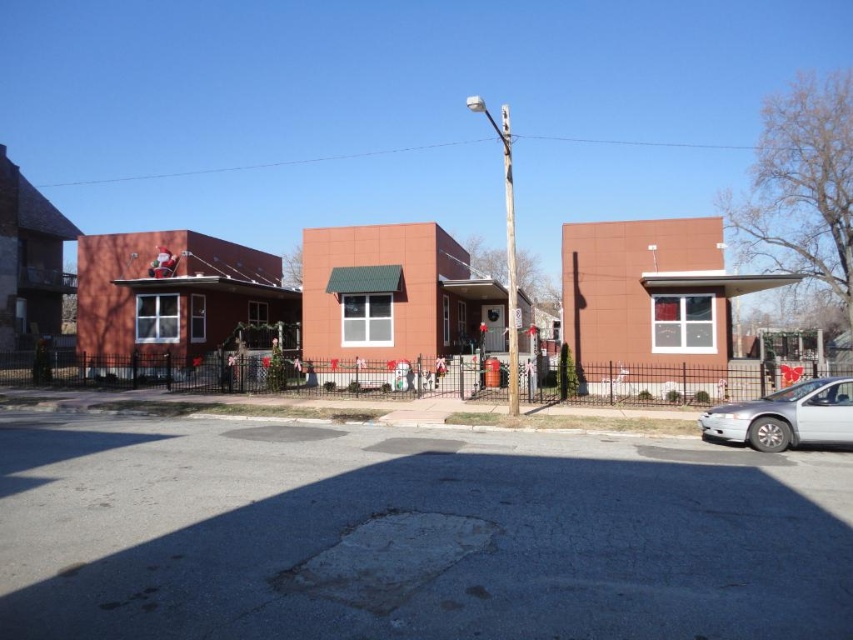
You are a delivery person trying to park your delivery van, which is 2 meters wide, in the residential street scene. There is a silver metallic sedan at lower right and a white wooden pole at center. Can you fit your van between them?

The silver metallic sedan at lower right is thinner than the white wooden pole at center. Since the van is 2 meters wide, you need to check the space between them. However, the description only states the sedan is thinner than the pole but doesn not provide exact measurements of the space between them. Therefore, it is uncertain if the van can fit between them based on the given information.

You are driving a car that is 5 meters long and want to park it between the silver metallic sedan at lower right and the white wooden pole at center. Is there enough space?

The distance between the silver metallic sedan at lower right and the white wooden pole at center is 8.93 meters. Since the car is 5 meters long, there is enough space to park between them.

You are standing in front of the three connected houses and want to take a photo. You notice two points marked on the image at coordinates point (799, 404) and point (515, 369). Which point is closer to your camera when taking the photo?

Point (799, 404) is closer to the camera than point (515, 369).